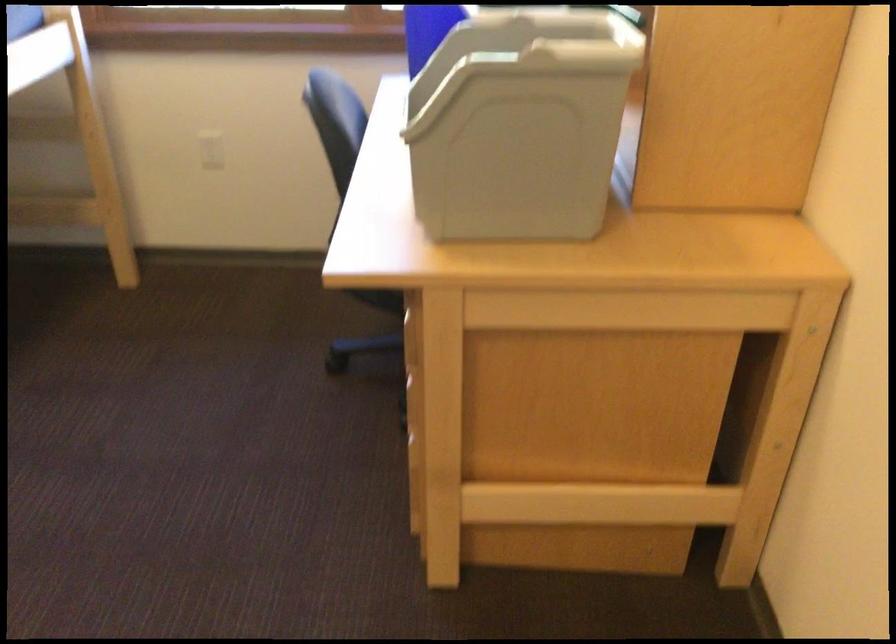
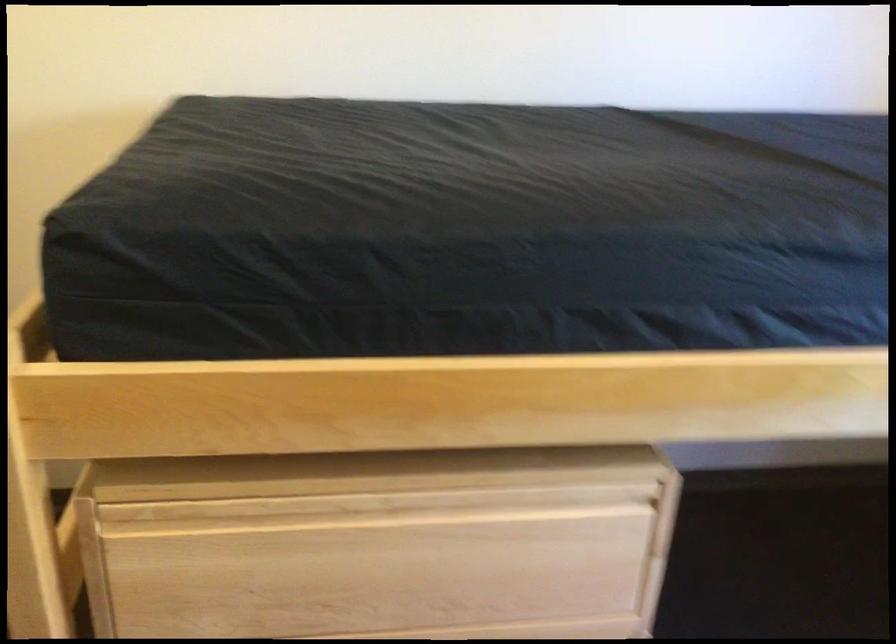
Question: The camera is either moving clockwise (left) or counter-clockwise (right) around the object. The first image is from the beginning of the video and the second image is from the end. Is the camera moving left or right when shooting the video?

Choices:
 (A) Left
 (B) Right

Answer: (B)